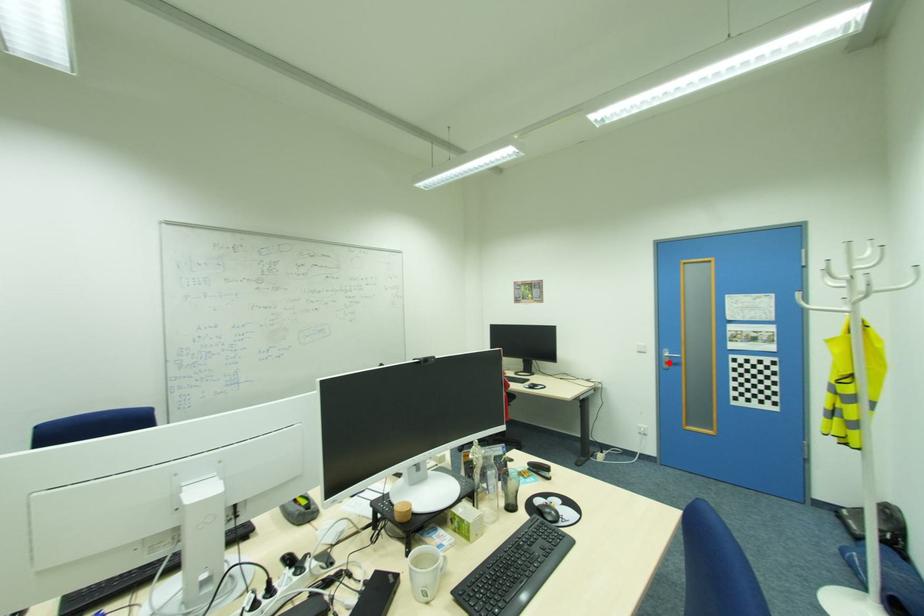
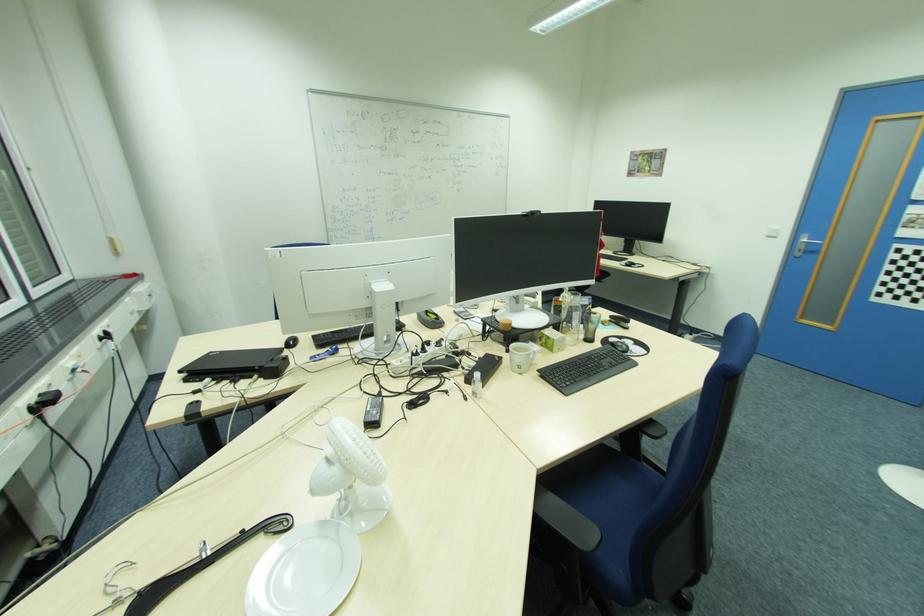
The point at the highlighted location is marked in the first image. Where is the corresponding point in the second image?

(804, 251)